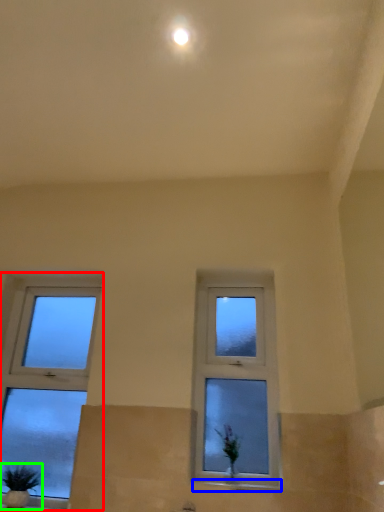
Question: Which is nearer to the window (highlighted by a red box)? window sill (highlighted by a blue box) or houseplant (highlighted by a green box).

Choices:
 (A) window sill
 (B) houseplant

Answer: (B)